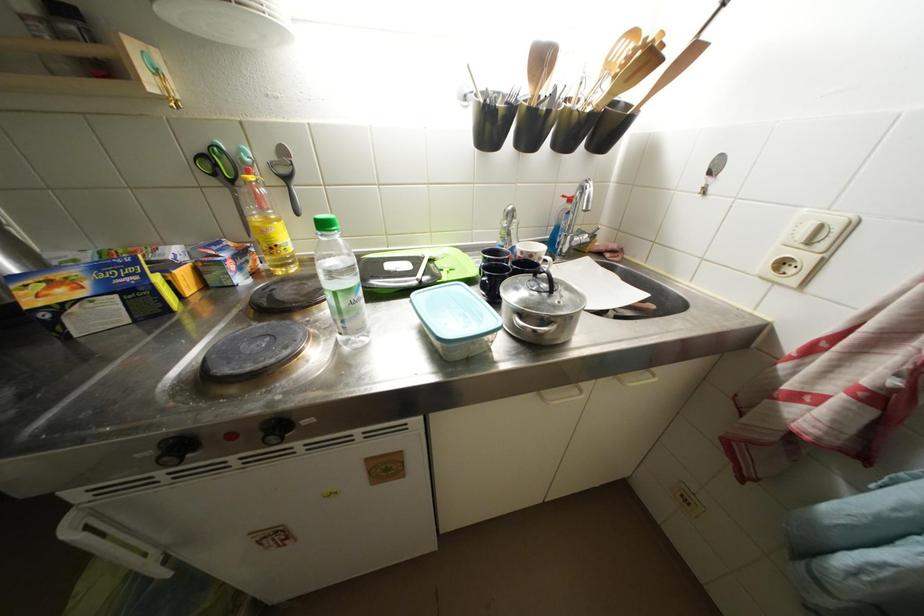
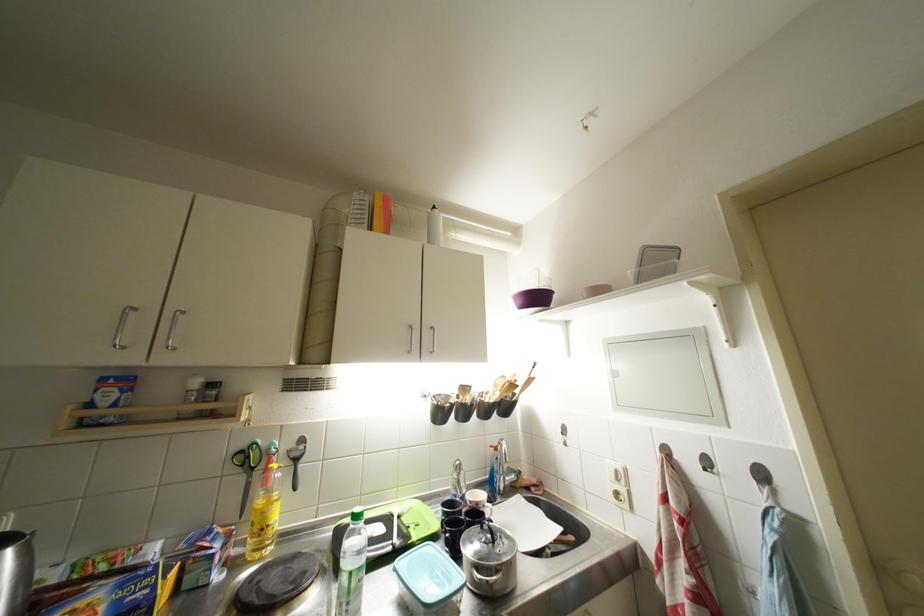
How did the camera likely rotate?

The rotation direction of the camera is right-up.